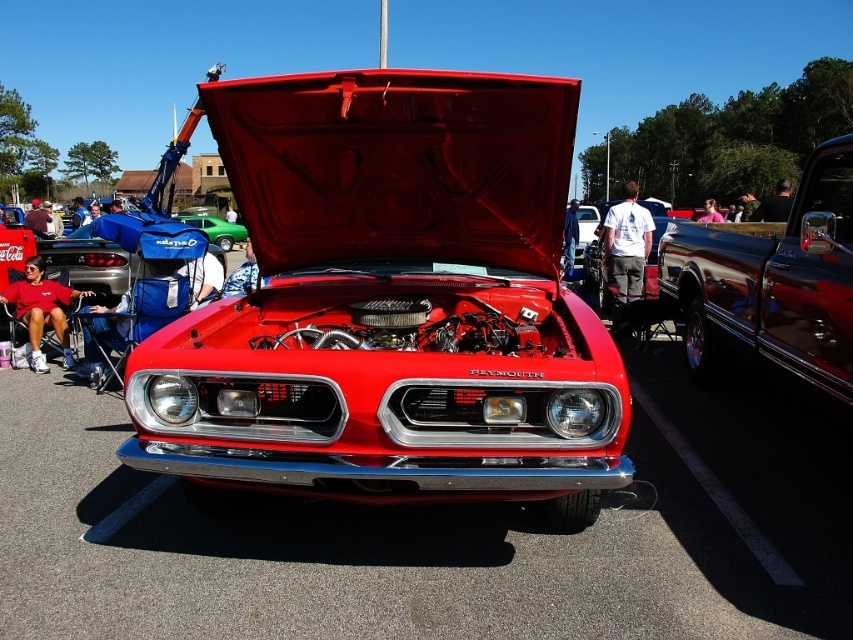
Is point (498, 333) farther from viewer compared to point (238, 241)?

No, it is not.

This screenshot has height=640, width=853. Find the location of `shiny red car at center`. shiny red car at center is located at coordinates (392, 305).

Does shiny red car at center have a greater height compared to glossy dark brown truck at right?

Indeed, shiny red car at center has a greater height compared to glossy dark brown truck at right.

Does shiny red car at center have a greater width compared to glossy dark brown truck at right?

In fact, shiny red car at center might be narrower than glossy dark brown truck at right.

Which is in front, point (607, 390) or point (738, 296)?

Point (607, 390) is more forward.

I want to click on shiny red car at center, so click(392, 305).

Is glossy dark brown truck at right taller than green matte car at center?

No.

In order to click on glossy dark brown truck at right in this screenshot , I will do `click(772, 285)`.